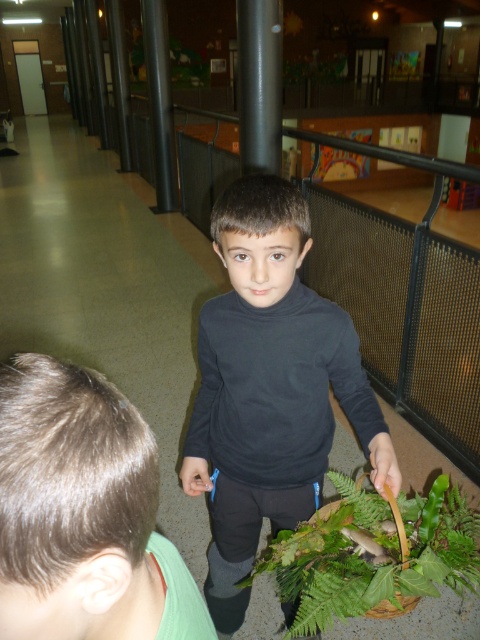
Is green leafy plant at lower center to the right of satin black pole at upper center from the viewer's perspective?

Indeed, green leafy plant at lower center is positioned on the right side of satin black pole at upper center.

Is point (342, 484) closer to viewer compared to point (280, 29)?

Yes.

Find the location of `green leafy plant at lower center`. green leafy plant at lower center is located at coordinates (372, 554).

At what (x,y) coordinates should I click in order to perform the action: click on green leafy plant at lower center. Please return your answer as a coordinate pair (x, y). Looking at the image, I should click on (372, 554).

Does smooth black shirt at center have a lesser height compared to green leafy plant at lower center?

Correct, smooth black shirt at center is not as tall as green leafy plant at lower center.

Does point (130, 520) come behind point (447, 483)?

No, it is in front of (447, 483).

Where is `smooth black shirt at center`? This screenshot has height=640, width=480. smooth black shirt at center is located at coordinates (84, 513).

Describe the element at coordinates (268, 388) in the screenshot. I see `black matte shirt at center` at that location.

The height and width of the screenshot is (640, 480). Find the location of `black matte shirt at center`. black matte shirt at center is located at coordinates 268,388.